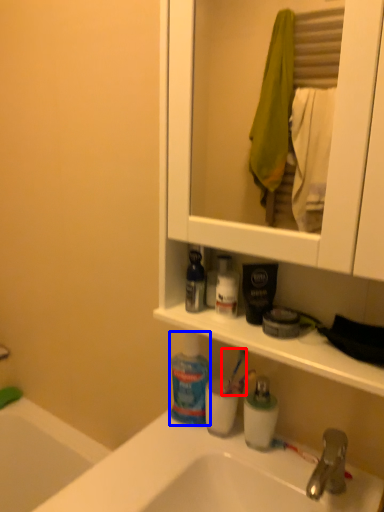
Question: Which point is closer to the camera, toothbrush (highlighted by a red box) or cleaning product (highlighted by a blue box)?

Choices:
 (A) toothbrush
 (B) cleaning product

Answer: (B)